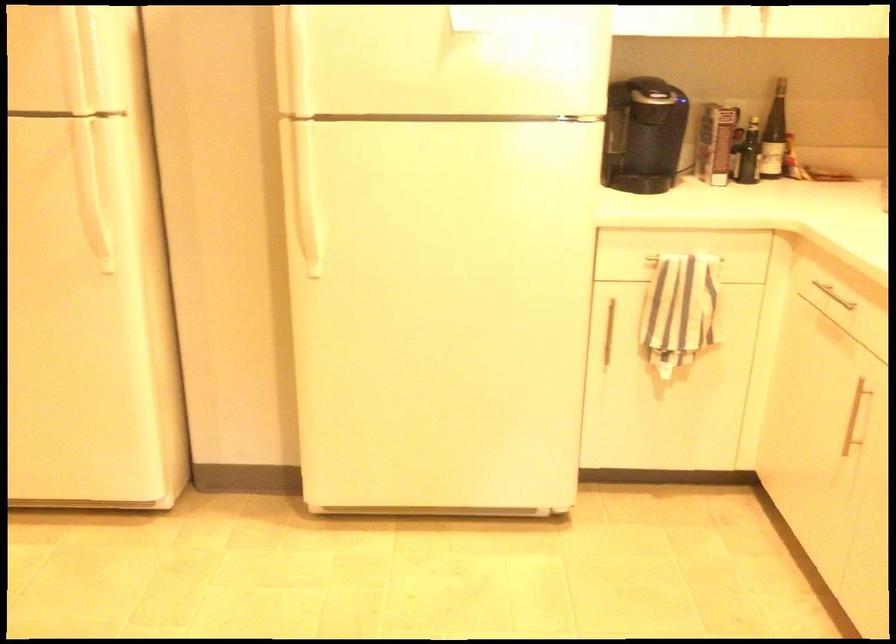
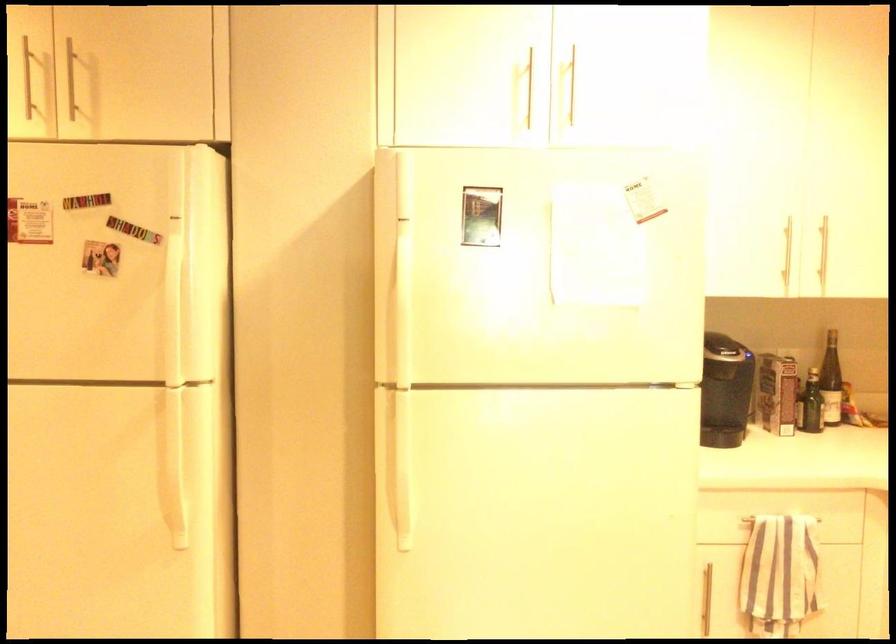
In the second image, find the point that corresponds to pixel 688 256 in the first image.

(781, 518)